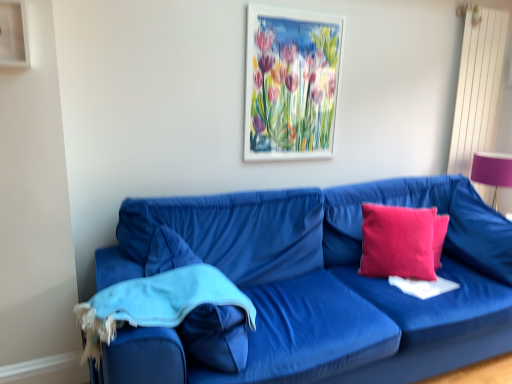
Question: From their relative heights in the image, would you say velvet blue couch at lower left is taller or shorter than blue cotton blanket at lower left?

Choices:
 (A) short
 (B) tall

Answer: (B)

Question: Is point (507, 243) positioned closer to the camera than point (151, 306)?

Choices:
 (A) closer
 (B) farther

Answer: (B)

Question: Based on their relative distances, which object is farther from the white matte picture frame at upper center?

Choices:
 (A) blue cotton blanket at lower left
 (B) pink fabric lampshade at right
 (C) pink velvet pillow at right, which ranks as the first pillow in left-to-right order
 (D) pink fabric pillow at right, which is counted as the second pillow, starting from the left
 (E) white fabric at center

Answer: (B)

Question: Which object is positioned farthest from the velvet blue couch at lower left?

Choices:
 (A) white fabric at center
 (B) pink velvet pillow at right, which ranks as the first pillow in left-to-right order
 (C) blue cotton blanket at lower left
 (D) pink fabric pillow at right, placed as the 1th pillow when sorted from right to left
 (E) white matte picture frame at upper center

Answer: (E)